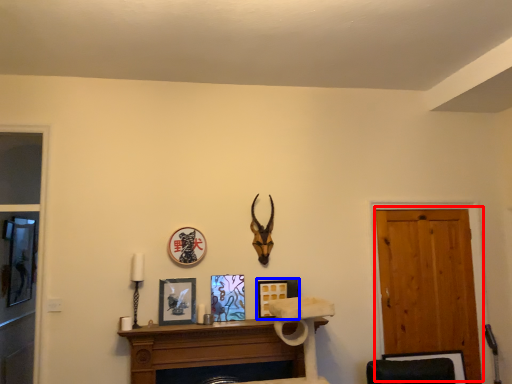
Question: Which object appears farthest to the camera in this image, door (highlighted by a red box) or picture frame (highlighted by a blue box)?

Choices:
 (A) door
 (B) picture frame

Answer: (A)